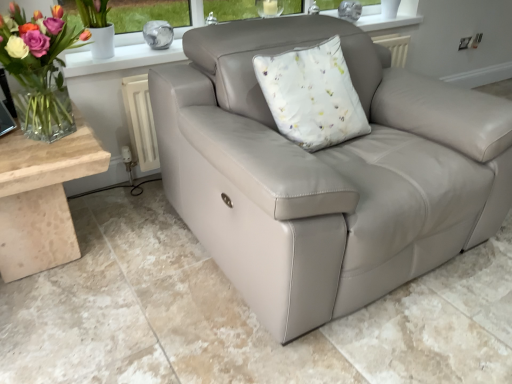
You are a GUI agent. You are given a task and a screenshot of the screen. Output one action in this format:
    pyautogui.click(x=<x>, y=<y>)
    Task: Click on the free space underneath clear glass vase at left (from a real-world perspective)
    This screenshot has width=512, height=384.
    Given the screenshot: What is the action you would take?
    pyautogui.click(x=59, y=133)